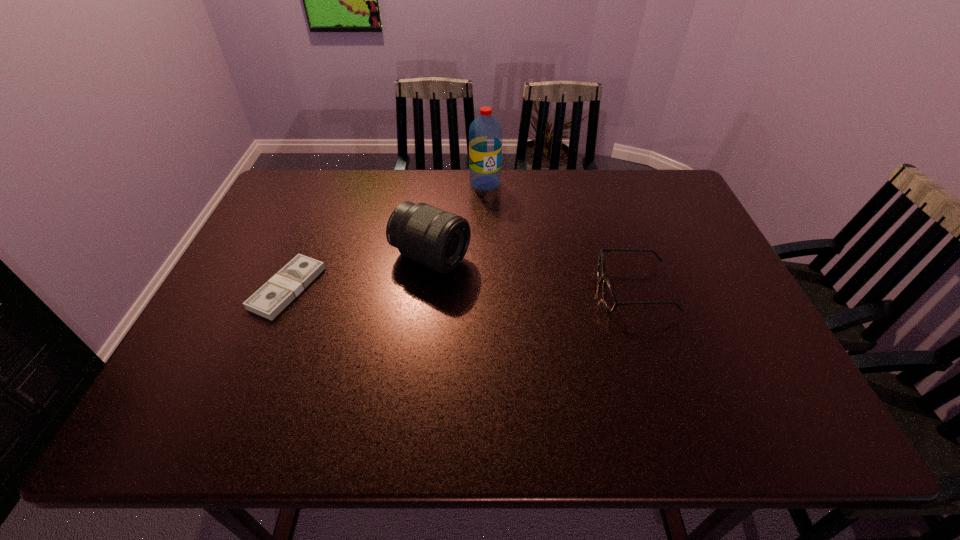
Find the location of a particular element. The height and width of the screenshot is (540, 960). free space on the desktop that is between the leftmost object and the third tallest object and is positioned on the front label of the water bottle is located at coordinates (509, 289).

Identify the location of free space on the desktop that is between the shortest object and the third tallest object and is positioned on the surface of the second tallest object. The height and width of the screenshot is (540, 960). (503, 289).